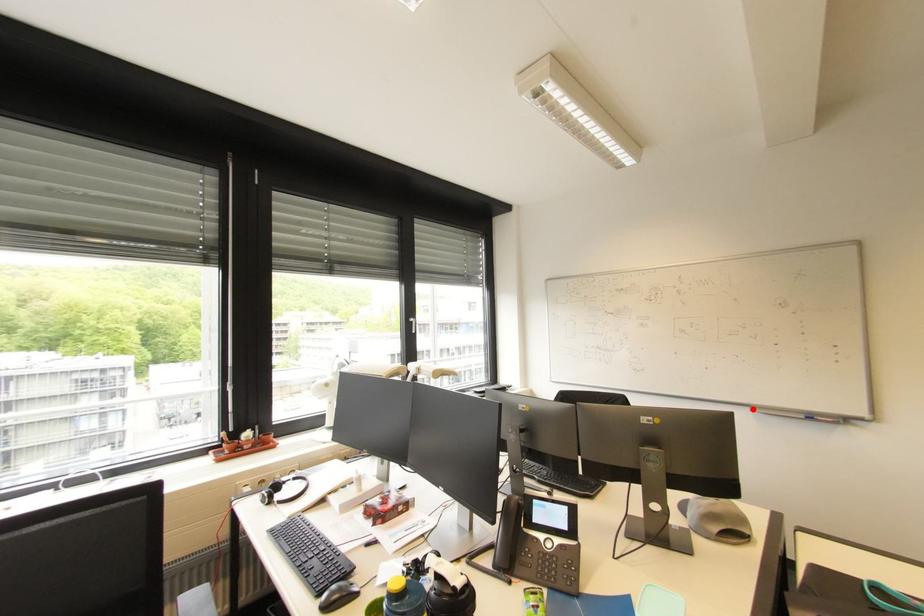
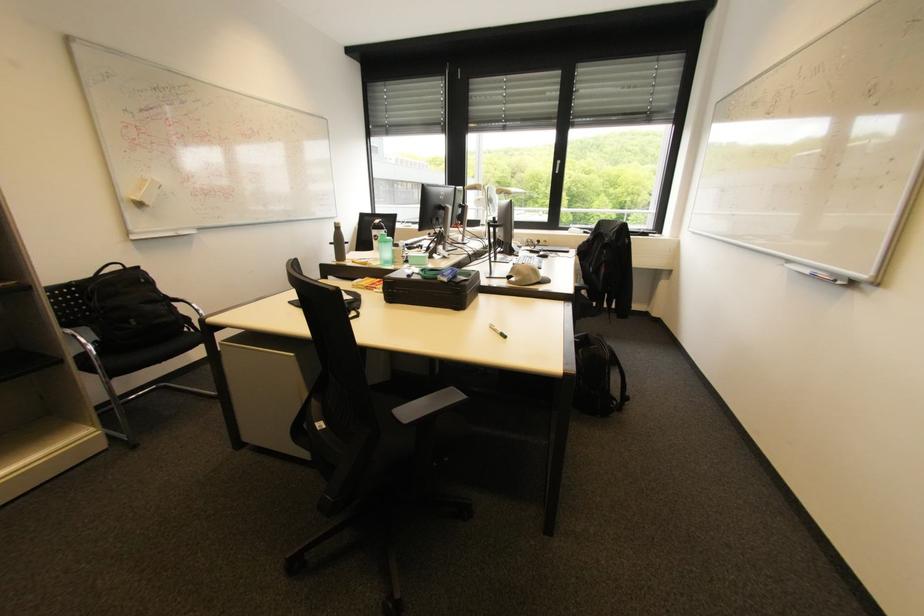
Question: I am providing you with two images of the same scene from different viewpoints. A red point is marked on the first image. Is the red point's position out of view in image 2?

Choices:
 (A) Yes
 (B) No

Answer: (B)